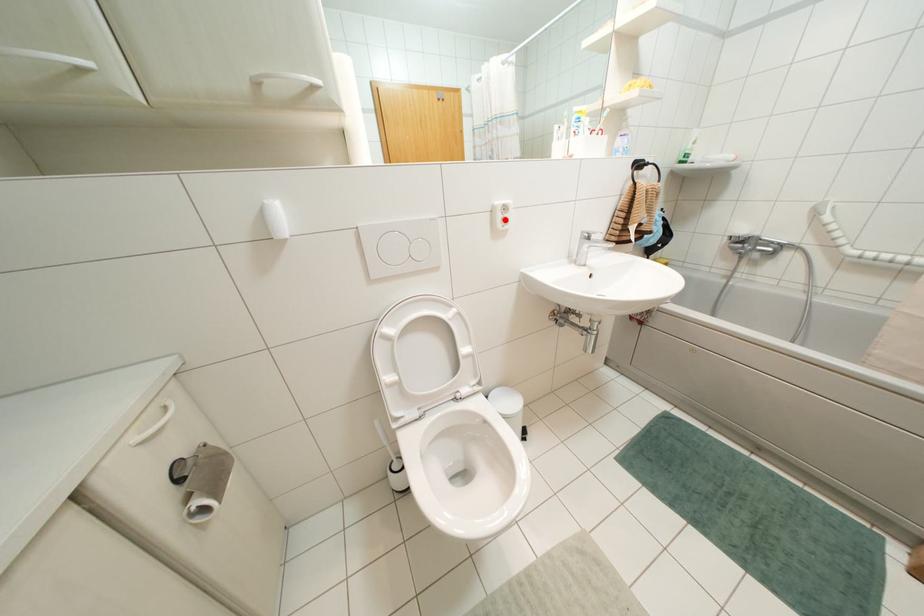
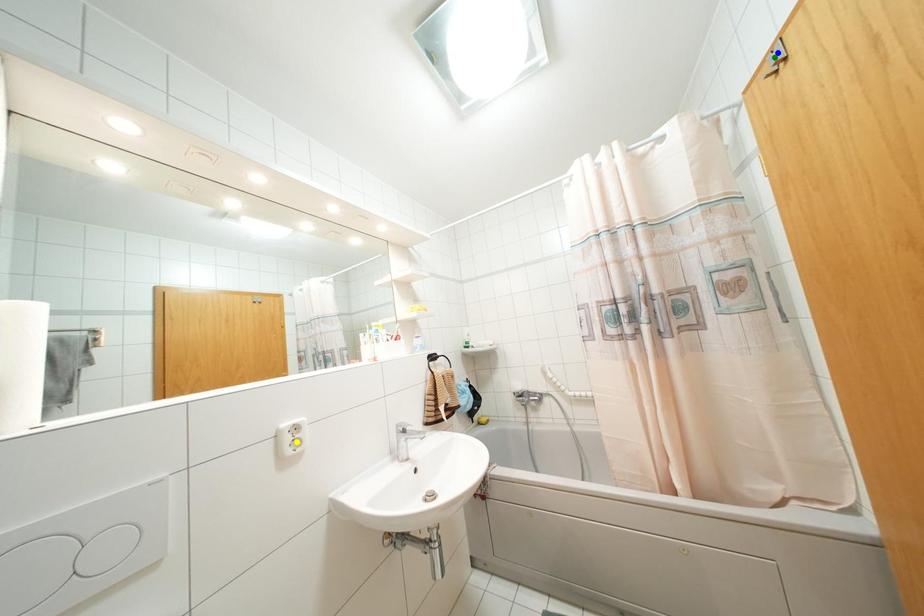
Question: I am providing you with two images of the same scene from different viewpoints. A red point is marked on the first image. You are given multiple points on the second image. In image 2, which mark is for the same physical point as the one in image 1?

Choices:
 (A) blue point
 (B) green point
 (C) yellow point

Answer: (C)